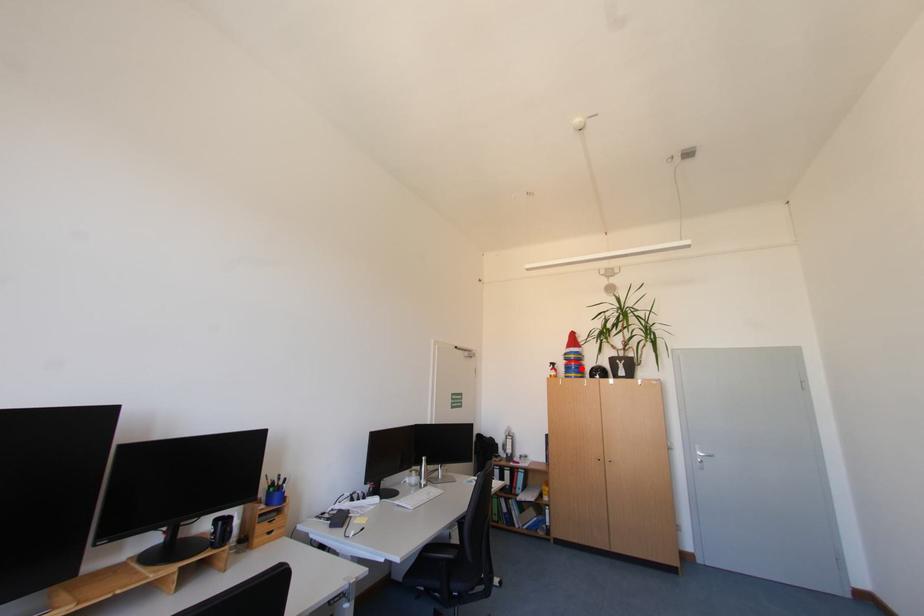
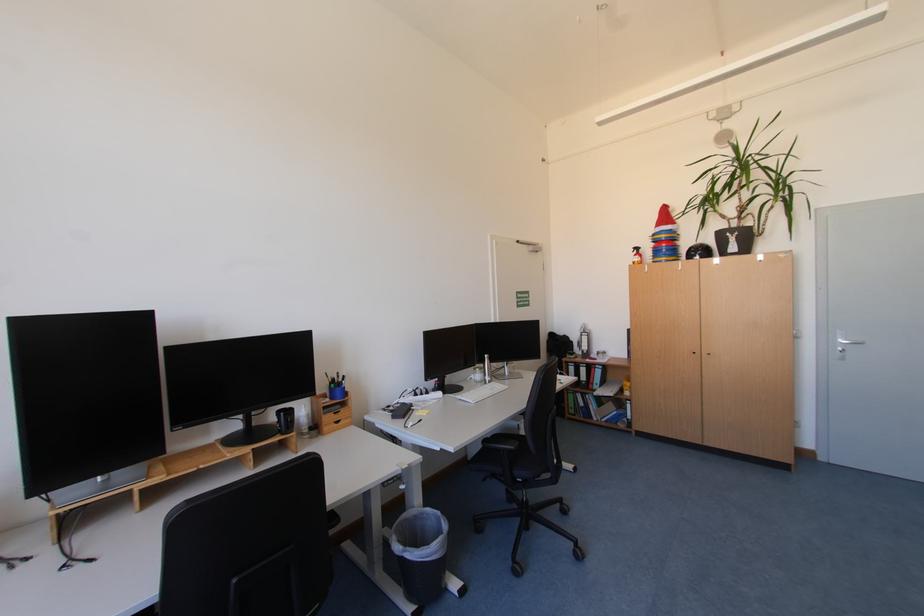
In the second image, find the point that corresponds to the highlighted location in the first image.

(672, 252)